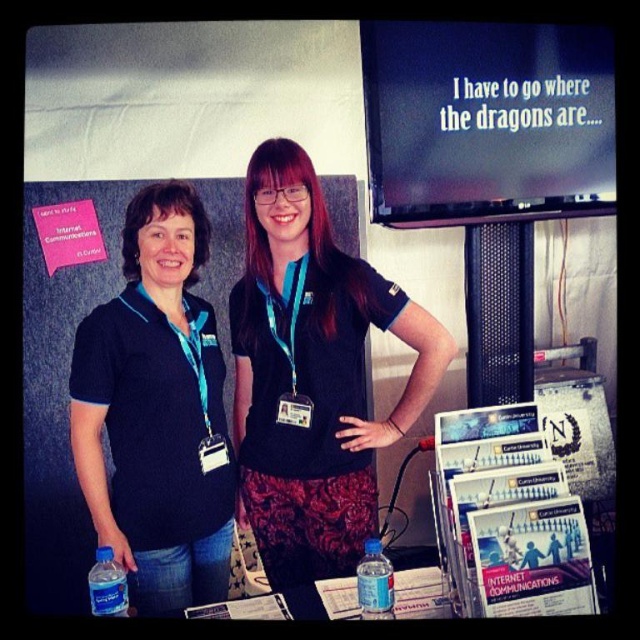
Which is more to the left, matte black shirt at center or blue plastic water bottle at lower center?

From the viewer's perspective, matte black shirt at center appears more on the left side.

Between matte black shirt at center and blue plastic water bottle at lower center, which one is positioned higher?

matte black shirt at center is above.

Locate an element on the screen. matte black shirt at center is located at coordinates (312, 374).

Identify the location of matte black shirt at center. The width and height of the screenshot is (640, 640). (312, 374).

Can you confirm if teal fabric lanyard at left is positioned below teal fabric lanyard at center?

Indeed, teal fabric lanyard at left is positioned under teal fabric lanyard at center.

Which of these two, teal fabric lanyard at left or teal fabric lanyard at center, stands taller?

Standing taller between the two is teal fabric lanyard at left.

I want to click on teal fabric lanyard at left, so click(195, 368).

The image size is (640, 640). Find the location of `teal fabric lanyard at left`. teal fabric lanyard at left is located at coordinates (195, 368).

Between matte black shirt at center and metallic badge at center, which one has more height?

matte black shirt at center

Identify the location of matte black shirt at center. (312, 374).

Who is more distant from viewer, (324, 508) or (221, 451)?

The point (221, 451) is more distant.

Identify the location of matte black shirt at center. (312, 374).